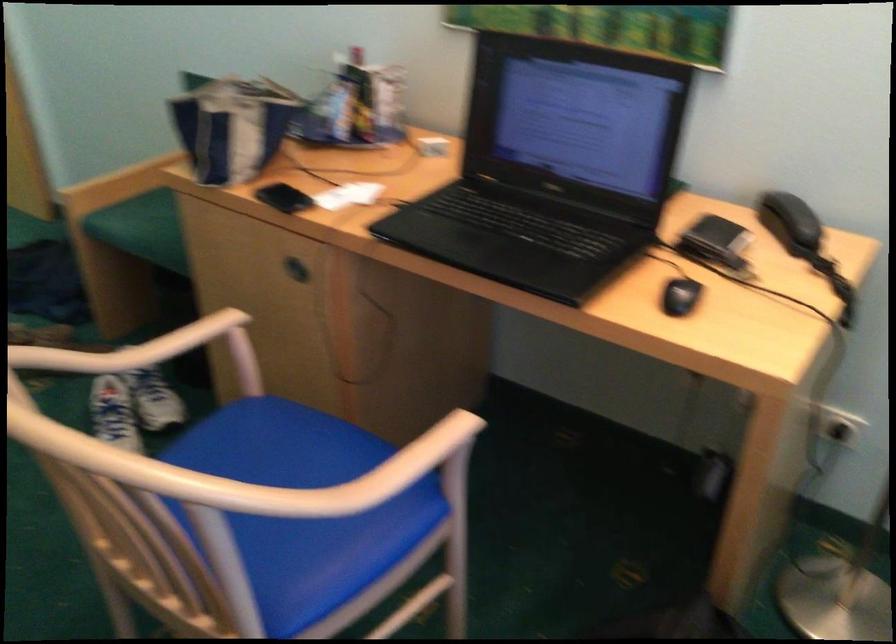
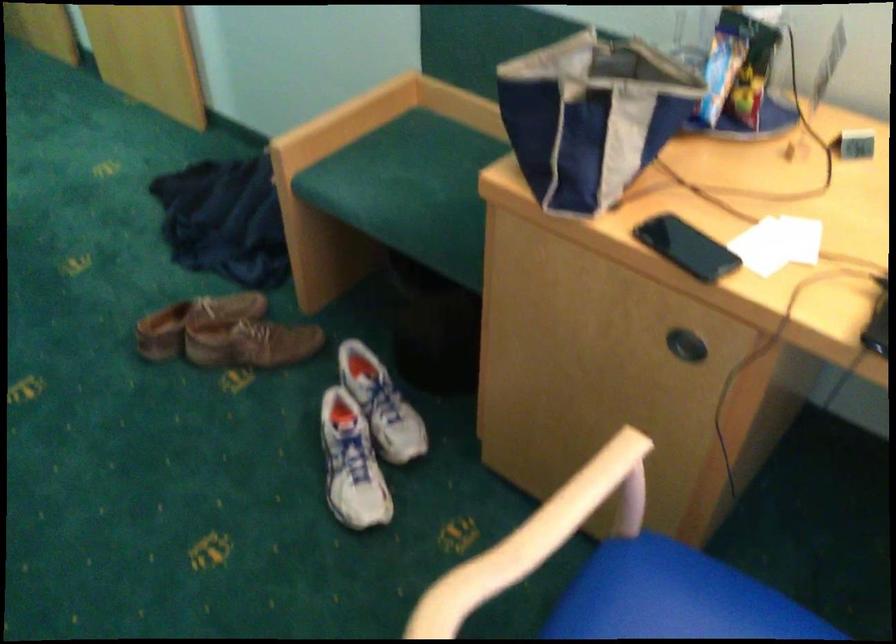
In a continuous first-person perspective shot, in which direction is the camera moving?

The cameraman walked toward left, forward.